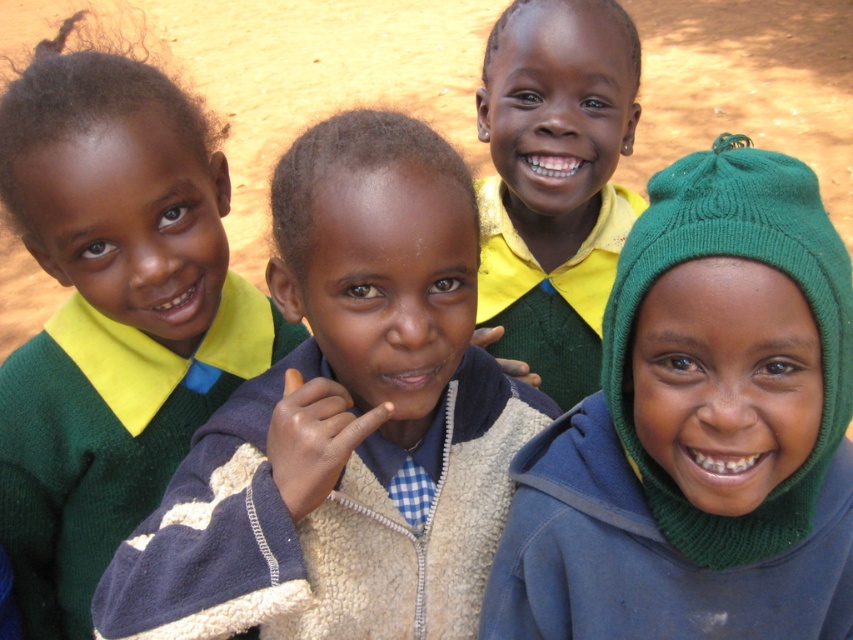
Question: Which point is closer to the camera?

Choices:
 (A) green knitted sweater at center
 (B) matte yellow shirt at center
 (C) green knitted hat at upper right
 (D) green wool sweater at upper left

Answer: (C)

Question: Estimate the real-world distances between objects in this image. Which object is farther from the matte yellow shirt at center?

Choices:
 (A) green knitted sweater at center
 (B) green knitted hat at upper right

Answer: (B)

Question: Which point is farther from the camera taking this photo?

Choices:
 (A) (415, 234)
 (B) (4, 493)

Answer: (B)

Question: Does green knitted hat at upper right have a larger size compared to matte yellow shirt at center?

Choices:
 (A) no
 (B) yes

Answer: (A)

Question: Is the position of green knitted hat at upper right less distant than that of matte yellow shirt at center?

Choices:
 (A) yes
 (B) no

Answer: (A)

Question: Is green wool sweater at upper left to the left of matte yellow shirt at center from the viewer's perspective?

Choices:
 (A) yes
 (B) no

Answer: (A)